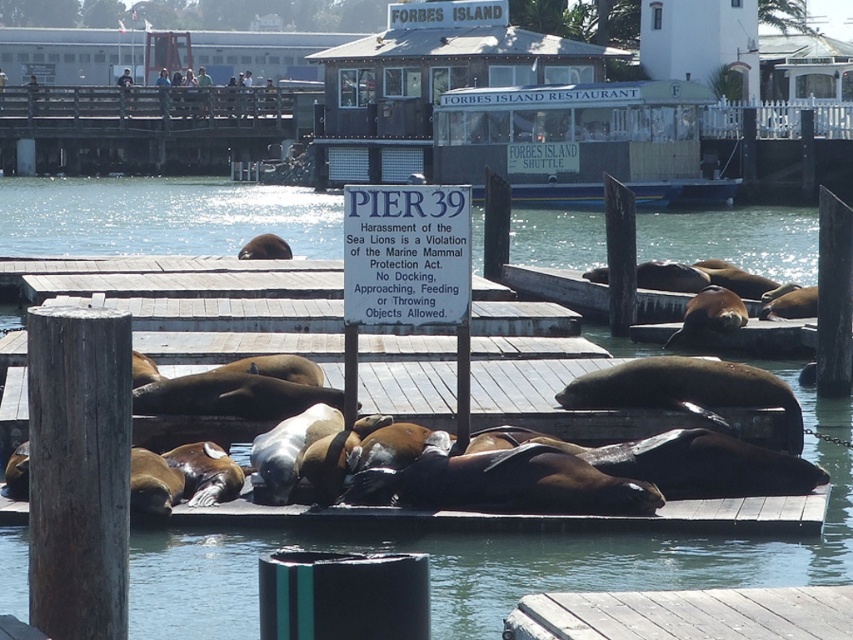
Question: Which point is farther to the camera?

Choices:
 (A) greenish-blue glass boat at center
 (B) clear water at dock center
 (C) white plastic boat at upper center
 (D) white plastic sign at center

Answer: (D)

Question: Can you confirm if white plastic boat at upper center is thinner than greenish-blue glass boat at center?

Choices:
 (A) no
 (B) yes

Answer: (A)

Question: Does white plastic boat at upper center have a greater width compared to greenish-blue glass boat at center?

Choices:
 (A) no
 (B) yes

Answer: (B)

Question: Does clear water at dock center have a greater width compared to wooden dock at lower center?

Choices:
 (A) yes
 (B) no

Answer: (A)

Question: Which point is farther from the camera taking this photo?

Choices:
 (A) [444, 28]
 (B) [358, 204]
 (C) [618, 579]
 (D) [596, 600]

Answer: (A)

Question: Estimate the real-world distances between objects in this image. Which object is closer to the greenish-blue glass boat at center?

Choices:
 (A) white plastic sign at center
 (B) clear water at dock center

Answer: (B)